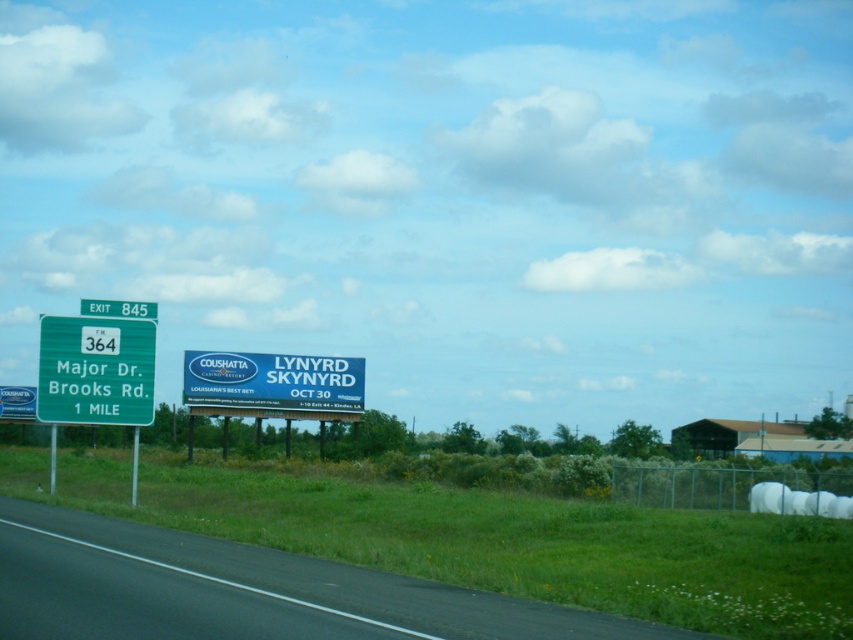
Question: Where is black asphalt road at lower left located in relation to green metallic sign at upper left in the image?

Choices:
 (A) left
 (B) right

Answer: (B)

Question: Which point appears farthest from the camera in this image?

Choices:
 (A) (131, 424)
 (B) (251, 582)

Answer: (A)

Question: Is black asphalt road at lower left above green metallic sign at upper left?

Choices:
 (A) yes
 (B) no

Answer: (B)

Question: Does black asphalt road at lower left appear on the right side of green metallic sign at upper left?

Choices:
 (A) yes
 (B) no

Answer: (A)